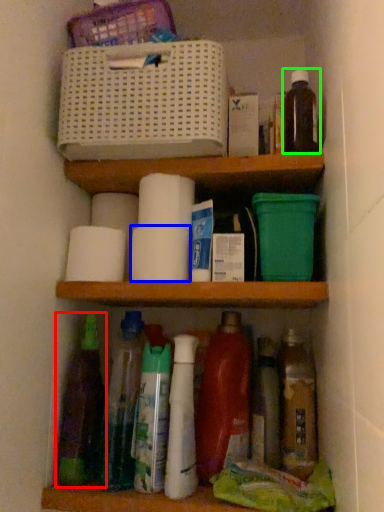
Question: Which object is the closest to the bottle (highlighted by a red box)? Choose among these: toilet paper (highlighted by a blue box) or bottle (highlighted by a green box).

Choices:
 (A) toilet paper
 (B) bottle

Answer: (A)